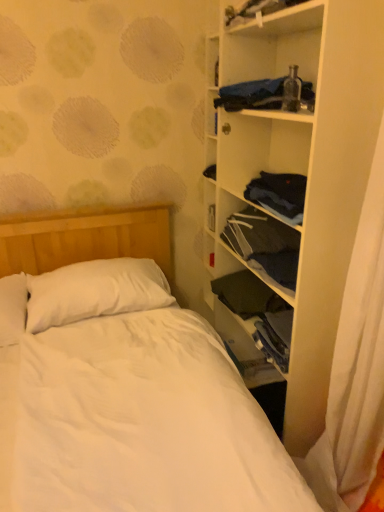
This screenshot has height=512, width=384. In order to click on blue fabric at upper right, which is the 1th clothing from top to bottom in this screenshot , I will do coord(252,95).

Identify the location of dark blue fabric at center right, positioned as the second clothing in top-to-bottom order. The image size is (384, 512). (264, 244).

You are a GUI agent. You are given a task and a screenshot of the screen. Output one action in this format:
    pyautogui.click(x=<x>, y=<y>)
    Task: Click on the white matte shelf at right
    The image size is (384, 512).
    Given the screenshot: What is the action you would take?
    pyautogui.click(x=302, y=167)

Could white matte shelf at right be considered to be inside white soft pillow at upper left?

No, white matte shelf at right is located outside of white soft pillow at upper left.

From the image's perspective, which object appears higher, white soft pillow at upper left or white matte shelf at right?

white matte shelf at right.

From the picture: Is white soft pillow at upper left behind white matte shelf at right?

Yes, white soft pillow at upper left is further from the viewer.

Can you tell me how much white soft pillow at upper left and white matte shelf at right differ in facing direction?

90.3 degrees.

Which of these two, white matte shelf at right or blue fabric at upper right, which is the 1th clothing from top to bottom, is thinner?

blue fabric at upper right, which is the 1th clothing from top to bottom, is thinner.

Are white matte shelf at right and blue fabric at upper right, which is counted as the third clothing, starting from the bottom, far apart?

white matte shelf at right is actually quite close to blue fabric at upper right, which is counted as the third clothing, starting from the bottom.

Is white matte shelf at right facing towards blue fabric at upper right, which is counted as the third clothing, starting from the bottom?

Yes, white matte shelf at right is turned towards blue fabric at upper right, which is counted as the third clothing, starting from the bottom.

From a real-world perspective, between dark blue fabric at center right, the 2th clothing when ordered from bottom to top, and white soft pillow at upper left, who is vertically lower?

From a 3D spatial view, white soft pillow at upper left is below.

Which is in front, point (269, 230) or point (97, 260)?

The point (269, 230) is closer to the camera.

Consider the image. Considering the relative sizes of dark blue fabric at center right, the 2th clothing when ordered from bottom to top, and white soft pillow at upper left in the image provided, is dark blue fabric at center right, the 2th clothing when ordered from bottom to top, shorter than white soft pillow at upper left?

Yes.

From the image's perspective, relative to white matte shelf at right, is dark blue fabric at center right, positioned as the second clothing in top-to-bottom order, above or below?

dark blue fabric at center right, positioned as the second clothing in top-to-bottom order, is situated lower than white matte shelf at right in the image.

Measure the distance between dark blue fabric at center right, the 2th clothing when ordered from bottom to top, and white matte shelf at right.

dark blue fabric at center right, the 2th clothing when ordered from bottom to top, is 34.54 centimeters away from white matte shelf at right.

Which is more to the left, dark blue fabric at center right, the 2th clothing when ordered from bottom to top, or white matte shelf at right?

dark blue fabric at center right, the 2th clothing when ordered from bottom to top.

Is dark blue fabric at center right, the 2th clothing when ordered from bottom to top, bigger or smaller than white matte shelf at right?

Clearly, dark blue fabric at center right, the 2th clothing when ordered from bottom to top, is smaller in size than white matte shelf at right.

Which of these two, dark blue fabric at center-right, which is counted as the 3th clothing, starting from the top, or white soft pillow at upper left, stands taller?

Standing taller between the two is white soft pillow at upper left.

In the image, there is a dark blue fabric at center-right, which is counted as the 3th clothing, starting from the top. At what (x,y) coordinates should I click in order to perform the action: click on pillow above it (from the image's perspective). Please return your answer as a coordinate pair (x, y). The height and width of the screenshot is (512, 384). Looking at the image, I should click on (95, 291).

Could you tell me if dark blue fabric at center-right, which is counted as the 3th clothing, starting from the top, is turned towards white soft pillow at upper left?

Yes.

From a real-world perspective, between dark blue fabric at center-right, which is counted as the 3th clothing, starting from the top, and white soft pillow at upper left, who is vertically lower?

From a 3D spatial view, dark blue fabric at center-right, which is counted as the 3th clothing, starting from the top, is below.

From the image's perspective, would you say dark blue fabric at center-right, which is counted as the 3th clothing, starting from the top, is positioned over white matte shelf at right?

No, from the image's perspective, dark blue fabric at center-right, which is counted as the 3th clothing, starting from the top, is not on top of white matte shelf at right.

Is the surface of dark blue fabric at center-right, which is counted as the 3th clothing, starting from the top, in direct contact with white matte shelf at right?

No.

Considering the sizes of objects dark blue fabric at center-right, positioned as the first clothing in bottom-to-top order, and white matte shelf at right in the image provided, who is bigger, dark blue fabric at center-right, positioned as the first clothing in bottom-to-top order, or white matte shelf at right?

Bigger between the two is white matte shelf at right.

What's the angular difference between dark blue fabric at center-right, positioned as the first clothing in bottom-to-top order, and white matte shelf at right's facing directions?

There is a 0.486-degree angle between the facing directions of dark blue fabric at center-right, positioned as the first clothing in bottom-to-top order, and white matte shelf at right.

Is blue fabric at upper right, which is the 1th clothing from top to bottom, to the left of dark blue fabric at center-right, positioned as the first clothing in bottom-to-top order, from the viewer's perspective?

Correct, you'll find blue fabric at upper right, which is the 1th clothing from top to bottom, to the left of dark blue fabric at center-right, positioned as the first clothing in bottom-to-top order.

Which is behind, blue fabric at upper right, which is counted as the third clothing, starting from the bottom, or dark blue fabric at center-right, positioned as the first clothing in bottom-to-top order?

dark blue fabric at center-right, positioned as the first clothing in bottom-to-top order, is further from the camera.

Measure the distance from blue fabric at upper right, which is the 1th clothing from top to bottom, to dark blue fabric at center-right, positioned as the first clothing in bottom-to-top order.

blue fabric at upper right, which is the 1th clothing from top to bottom, and dark blue fabric at center-right, positioned as the first clothing in bottom-to-top order, are 33.51 inches apart.

From the picture: From a real-world perspective, which object stands above the other?

In real-world perspective, blue fabric at upper right, which is counted as the third clothing, starting from the bottom, is above.

Find the location of a particular element. pillow that is on the left side of white matte shelf at right is located at coordinates (95, 291).

Locate an element on the screen. The image size is (384, 512). clothing above the white matte shelf at right (from the image's perspective) is located at coordinates (252, 95).

Which object lies nearer to the anchor point blue fabric at upper right, which is the 1th clothing from top to bottom, dark blue fabric at center right, positioned as the second clothing in top-to-bottom order, or white soft pillow at upper left?

The object closer to blue fabric at upper right, which is the 1th clothing from top to bottom, is dark blue fabric at center right, positioned as the second clothing in top-to-bottom order.

Estimate the real-world distances between objects in this image. Which object is closer to white matte shelf at right, dark blue fabric at center-right, positioned as the first clothing in bottom-to-top order, or white soft pillow at upper left?

Among the two, dark blue fabric at center-right, positioned as the first clothing in bottom-to-top order, is located nearer to white matte shelf at right.

Based on their spatial positions, is white matte shelf at right or blue fabric at upper right, which is the 1th clothing from top to bottom, further from white soft pillow at upper left?

blue fabric at upper right, which is the 1th clothing from top to bottom, lies further to white soft pillow at upper left than the other object.

Looking at the image, which one is located closer to blue fabric at upper right, which is the 1th clothing from top to bottom, white matte shelf at right or white soft pillow at upper left?

The object closer to blue fabric at upper right, which is the 1th clothing from top to bottom, is white matte shelf at right.

Based on the photo, which object lies further to the anchor point dark blue fabric at center-right, which is counted as the 3th clothing, starting from the top, blue fabric at upper right, which is counted as the third clothing, starting from the bottom, or white soft pillow at upper left?

blue fabric at upper right, which is counted as the third clothing, starting from the bottom, lies further to dark blue fabric at center-right, which is counted as the 3th clothing, starting from the top, than the other object.

Looking at this image, based on their spatial positions, is white soft pillow at upper left or white matte shelf at right further from dark blue fabric at center-right, positioned as the first clothing in bottom-to-top order?

The object further to dark blue fabric at center-right, positioned as the first clothing in bottom-to-top order, is white soft pillow at upper left.

Looking at the image, which one is located further to blue fabric at upper right, which is the 1th clothing from top to bottom, white soft pillow at upper left or dark blue fabric at center right, the 2th clothing when ordered from bottom to top?

Based on the image, white soft pillow at upper left appears to be further to blue fabric at upper right, which is the 1th clothing from top to bottom.

When comparing their distances from dark blue fabric at center right, positioned as the second clothing in top-to-bottom order, does white matte shelf at right or blue fabric at upper right, which is counted as the third clothing, starting from the bottom, seem further?

blue fabric at upper right, which is counted as the third clothing, starting from the bottom, is further to dark blue fabric at center right, positioned as the second clothing in top-to-bottom order.

Identify the location of clothing between blue fabric at upper right, which is the 1th clothing from top to bottom, and dark blue fabric at center-right, positioned as the first clothing in bottom-to-top order, vertically. (264, 244).

Identify the location of clothing between blue fabric at upper right, which is counted as the third clothing, starting from the bottom, and white soft pillow at upper left in the up-down direction. The image size is (384, 512). (264, 244).

Image resolution: width=384 pixels, height=512 pixels. Find the location of `clothing between white matte shelf at right and dark blue fabric at center right, positioned as the second clothing in top-to-bottom order, in the front-back direction`. clothing between white matte shelf at right and dark blue fabric at center right, positioned as the second clothing in top-to-bottom order, in the front-back direction is located at coordinates (252, 95).

Where is `shelf between blue fabric at upper right, which is counted as the third clothing, starting from the bottom, and dark blue fabric at center-right, positioned as the first clothing in bottom-to-top order, vertically`? shelf between blue fabric at upper right, which is counted as the third clothing, starting from the bottom, and dark blue fabric at center-right, positioned as the first clothing in bottom-to-top order, vertically is located at coordinates (302, 167).